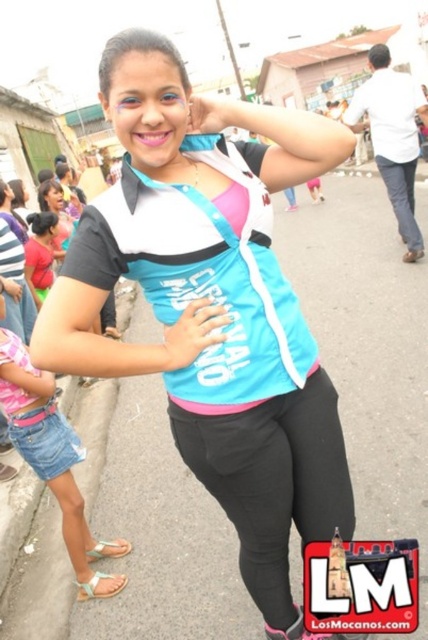
Which is more to the right, black leggings at center or matte black shirt at left?

black leggings at center is more to the right.

Can you confirm if black leggings at center is positioned below matte black shirt at left?

Yes.

Find the location of `black leggings at center`. black leggings at center is located at coordinates (273, 481).

Who is lower down, black leggings at center or denim shorts at lower left?

denim shorts at lower left is below.

Which of these two, black leggings at center or denim shorts at lower left, stands shorter?

black leggings at center

Which is behind, point (204, 422) or point (26, 419)?

Point (26, 419)

Locate an element on the screen. The height and width of the screenshot is (640, 428). black leggings at center is located at coordinates (273, 481).

Between matte black shirt at left and matte pink shirt at left, which one has less height?

With less height is matte black shirt at left.

In the scene shown: Who is higher up, matte black shirt at left or matte pink shirt at left?

matte pink shirt at left is higher up.

Find the location of a particular element. The width and height of the screenshot is (428, 640). matte black shirt at left is located at coordinates (39, 253).

Locate an element on the screen. This screenshot has height=640, width=428. matte black shirt at left is located at coordinates (39, 253).